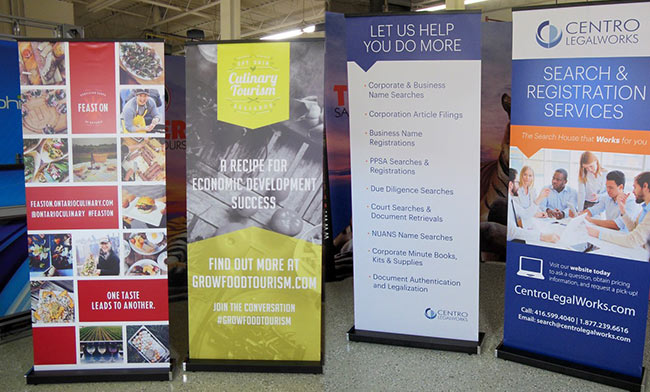
Where is `floor`? floor is located at coordinates (393, 362).